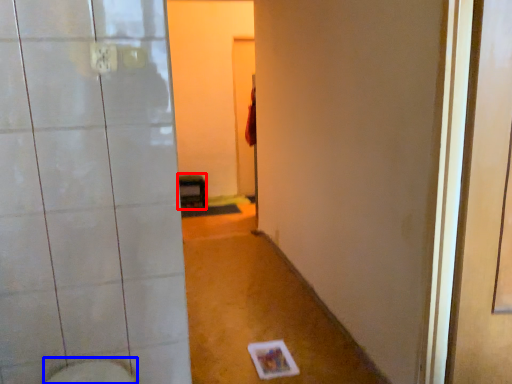
Question: Among these objects, which one is nearest to the camera, furniture (highlighted by a red box) or bidet (highlighted by a blue box)?

Choices:
 (A) furniture
 (B) bidet

Answer: (B)